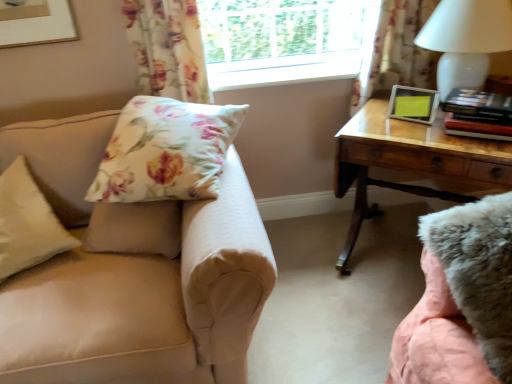
You are a GUI agent. You are given a task and a screenshot of the screen. Output one action in this format:
    pyautogui.click(x=<x>, y=<y>)
    Task: Click on the vacant space to the left of hardcover books at right
    
    Given the screenshot: What is the action you would take?
    pyautogui.click(x=422, y=134)